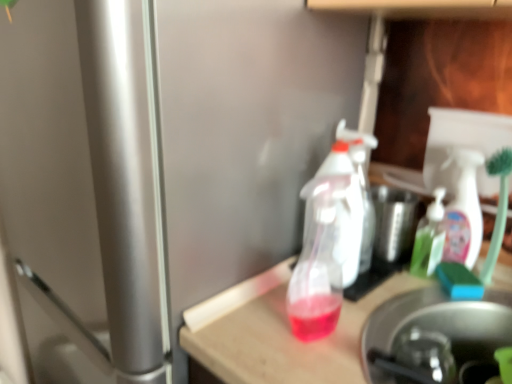
Locate an element on the screen. The width and height of the screenshot is (512, 384). translucent plastic spray bottle at center, the 1th bottle when ordered from left to right is located at coordinates (326, 246).

Measure the distance between point (334,203) and camera.

Point (334,203) and camera are 26.38 inches apart from each other.

Locate an element on the screen. The width and height of the screenshot is (512, 384). translucent plastic table at center is located at coordinates (278, 333).

Who is taller, translucent plastic table at center or stainless steel sink at lower right?

Standing taller between the two is translucent plastic table at center.

Looking at this image, is stainless steel sink at lower right at the back of translucent plastic table at center?

translucent plastic table at center does not have its back to stainless steel sink at lower right.

From the image's perspective, is stainless steel sink at lower right above or below translucent plastic spray bottle at center, the 2th bottle positioned from the back?

stainless steel sink at lower right is situated lower than translucent plastic spray bottle at center, the 2th bottle positioned from the back, in the image.

Is point (391, 339) positioned before point (311, 247)?

Yes, point (391, 339) is in front of point (311, 247).

The width and height of the screenshot is (512, 384). What are the coordinates of `bottle that appears on the left of stainless steel sink at lower right` in the screenshot? It's located at (326, 246).

Which object is wider, stainless steel sink at lower right or translucent plastic spray bottle at center, the 1th bottle when ordered from left to right?

With larger width is stainless steel sink at lower right.

Who is bigger, translucent plastic spray bottle at center, positioned as the first bottle in front-to-back order, or stainless steel sink at lower right?

Bigger between the two is stainless steel sink at lower right.

Considering the sizes of translucent plastic spray bottle at center, the 1th bottle when ordered from left to right, and stainless steel sink at lower right in the image, is translucent plastic spray bottle at center, the 1th bottle when ordered from left to right, wider or thinner than stainless steel sink at lower right?

translucent plastic spray bottle at center, the 1th bottle when ordered from left to right, is thinner than stainless steel sink at lower right.

Is translucent plastic spray bottle at center, the 1th bottle when ordered from left to right, positioned far away from stainless steel sink at lower right?

Actually, translucent plastic spray bottle at center, the 1th bottle when ordered from left to right, and stainless steel sink at lower right are a little close together.

Which object is closer to the camera, translucent plastic spray bottle at center, positioned as the first bottle in front-to-back order, or stainless steel sink at lower right?

stainless steel sink at lower right is closer to the camera.

Is green translucent soap dispenser at center, positioned as the second bottle in front-to-back order, bigger or smaller than translucent plastic table at center?

In the image, green translucent soap dispenser at center, positioned as the second bottle in front-to-back order, appears to be smaller than translucent plastic table at center.

Considering the sizes of objects green translucent soap dispenser at center, marked as the first bottle in a back-to-front arrangement, and translucent plastic table at center in the image provided, who is taller, green translucent soap dispenser at center, marked as the first bottle in a back-to-front arrangement, or translucent plastic table at center?

→ Standing taller between the two is translucent plastic table at center.

Which is more to the right, green translucent soap dispenser at center, marked as the first bottle in a back-to-front arrangement, or translucent plastic table at center?

green translucent soap dispenser at center, marked as the first bottle in a back-to-front arrangement.

From a real-world perspective, is green translucent soap dispenser at center, the first bottle positioned from the right, on translucent plastic table at center?

Yes, from a real-world perspective, green translucent soap dispenser at center, the first bottle positioned from the right, is above translucent plastic table at center.

Considering their positions, is translucent plastic table at center located in front of or behind green translucent soap dispenser at center, which is counted as the 2th bottle, starting from the left?

Clearly, translucent plastic table at center is in front of green translucent soap dispenser at center, which is counted as the 2th bottle, starting from the left.

From the image's perspective, which is above, translucent plastic table at center or green translucent soap dispenser at center, the first bottle positioned from the right?

green translucent soap dispenser at center, the first bottle positioned from the right, is shown above in the image.

Is translucent plastic table at center looking in the opposite direction of green translucent soap dispenser at center, positioned as the second bottle in front-to-back order?

translucent plastic table at center is not turned away from green translucent soap dispenser at center, positioned as the second bottle in front-to-back order.

Considering the relative sizes of translucent plastic table at center and green translucent soap dispenser at center, marked as the first bottle in a back-to-front arrangement, in the image provided, is translucent plastic table at center taller than green translucent soap dispenser at center, marked as the first bottle in a back-to-front arrangement,?

Indeed, translucent plastic table at center has a greater height compared to green translucent soap dispenser at center, marked as the first bottle in a back-to-front arrangement.

Is the depth of translucent plastic spray bottle at center, which appears as the 2th bottle when viewed from the right, greater than that of green translucent soap dispenser at center, which is counted as the 2th bottle, starting from the left?

No, translucent plastic spray bottle at center, which appears as the 2th bottle when viewed from the right, is closer to the camera.

Does translucent plastic spray bottle at center, which appears as the 2th bottle when viewed from the right, have a larger size compared to green translucent soap dispenser at center, positioned as the second bottle in front-to-back order?

Indeed, translucent plastic spray bottle at center, which appears as the 2th bottle when viewed from the right, has a larger size compared to green translucent soap dispenser at center, positioned as the second bottle in front-to-back order.

Does translucent plastic spray bottle at center, positioned as the first bottle in front-to-back order, touch green translucent soap dispenser at center, which is counted as the 2th bottle, starting from the left?

No, translucent plastic spray bottle at center, positioned as the first bottle in front-to-back order, is not touching green translucent soap dispenser at center, which is counted as the 2th bottle, starting from the left.

Where is `bottle that appears on the right of translucent plastic spray bottle at center, the 2th bottle positioned from the back`? bottle that appears on the right of translucent plastic spray bottle at center, the 2th bottle positioned from the back is located at coordinates (429, 238).

In terms of size, does green translucent soap dispenser at center, which is counted as the 2th bottle, starting from the left, appear bigger or smaller than translucent plastic spray bottle at center, the 2th bottle positioned from the back?

In the image, green translucent soap dispenser at center, which is counted as the 2th bottle, starting from the left, appears to be smaller than translucent plastic spray bottle at center, the 2th bottle positioned from the back.

Considering the sizes of objects green translucent soap dispenser at center, marked as the first bottle in a back-to-front arrangement, and translucent plastic spray bottle at center, the 2th bottle positioned from the back, in the image provided, who is taller, green translucent soap dispenser at center, marked as the first bottle in a back-to-front arrangement, or translucent plastic spray bottle at center, the 2th bottle positioned from the back,?

Standing taller between the two is translucent plastic spray bottle at center, the 2th bottle positioned from the back.

From the image's perspective, which one is positioned lower, green translucent soap dispenser at center, which is counted as the 2th bottle, starting from the left, or translucent plastic spray bottle at center, which appears as the 2th bottle when viewed from the right?

translucent plastic spray bottle at center, which appears as the 2th bottle when viewed from the right, appears lower in the image.

The height and width of the screenshot is (384, 512). I want to click on appliance above the translucent plastic table at center (from a real-world perspective), so click(x=433, y=335).

From the image's perspective, starting from the stainless steel sink at lower right, which bottle is the 1st one above? Please provide its 2D coordinates.

[(326, 246)]

Looking at this image, from the image, which object appears to be farther from translucent plastic table at center, translucent plastic spray bottle at center, positioned as the first bottle in front-to-back order, or green translucent soap dispenser at center, marked as the first bottle in a back-to-front arrangement?

green translucent soap dispenser at center, marked as the first bottle in a back-to-front arrangement, lies further to translucent plastic table at center than the other object.

Looking at the image, which one is located further to translucent plastic spray bottle at center, which appears as the 2th bottle when viewed from the right, stainless steel sink at lower right or green translucent soap dispenser at center, marked as the first bottle in a back-to-front arrangement?

Among the two, green translucent soap dispenser at center, marked as the first bottle in a back-to-front arrangement, is located further to translucent plastic spray bottle at center, which appears as the 2th bottle when viewed from the right.

Considering their positions, is stainless steel sink at lower right positioned closer to translucent plastic spray bottle at center, the 1th bottle when ordered from left to right, than translucent plastic table at center?

translucent plastic table at center lies closer to translucent plastic spray bottle at center, the 1th bottle when ordered from left to right, than the other object.

When comparing their distances from green translucent soap dispenser at center, positioned as the second bottle in front-to-back order, does translucent plastic spray bottle at center, the 2th bottle positioned from the back, or translucent plastic table at center seem further?

Among the two, translucent plastic table at center is located further to green translucent soap dispenser at center, positioned as the second bottle in front-to-back order.

Estimate the real-world distances between objects in this image. Which object is closer to translucent plastic table at center, stainless steel sink at lower right or green translucent soap dispenser at center, marked as the first bottle in a back-to-front arrangement?

stainless steel sink at lower right.

Which object lies nearer to the anchor point stainless steel sink at lower right, translucent plastic table at center or translucent plastic spray bottle at center, which appears as the 2th bottle when viewed from the right?

translucent plastic table at center.

Estimate the real-world distances between objects in this image. Which object is further from translucent plastic spray bottle at center, the 1th bottle when ordered from left to right, green translucent soap dispenser at center, positioned as the second bottle in front-to-back order, or stainless steel sink at lower right?

green translucent soap dispenser at center, positioned as the second bottle in front-to-back order, is positioned further to the anchor translucent plastic spray bottle at center, the 1th bottle when ordered from left to right.

Which object lies further to the anchor point translucent plastic table at center, green translucent soap dispenser at center, positioned as the second bottle in front-to-back order, or translucent plastic spray bottle at center, positioned as the first bottle in front-to-back order?

Among the two, green translucent soap dispenser at center, positioned as the second bottle in front-to-back order, is located further to translucent plastic table at center.

You are a GUI agent. You are given a task and a screenshot of the screen. Output one action in this format:
    pyautogui.click(x=<x>, y=<y>)
    Task: Click on the appliance between translucent plastic table at center and green translucent soap dispenser at center, which is counted as the 2th bottle, starting from the left, from front to back
    The height and width of the screenshot is (384, 512).
    Given the screenshot: What is the action you would take?
    pyautogui.click(x=433, y=335)

Find the location of a particular element. This screenshot has width=512, height=384. bottle between translucent plastic table at center and green translucent soap dispenser at center, positioned as the second bottle in front-to-back order, in the front-back direction is located at coordinates (326, 246).

Locate an element on the screen. Image resolution: width=512 pixels, height=384 pixels. bottle between stainless steel sink at lower right and green translucent soap dispenser at center, marked as the first bottle in a back-to-front arrangement, along the z-axis is located at coordinates (326, 246).

The height and width of the screenshot is (384, 512). Identify the location of appliance that lies between translucent plastic spray bottle at center, positioned as the first bottle in front-to-back order, and translucent plastic table at center from top to bottom. (433, 335).